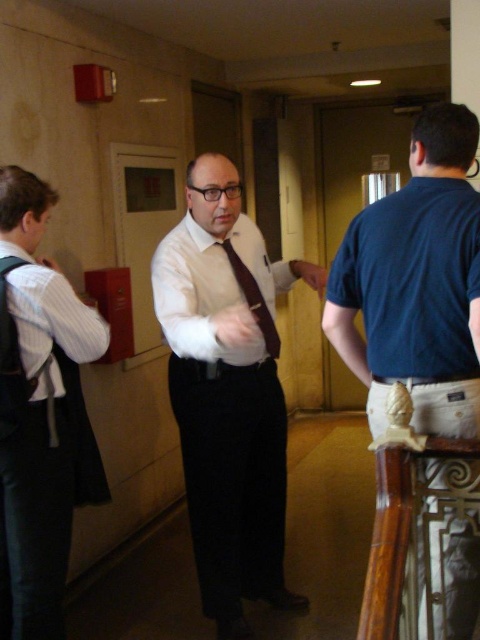
Between striped cotton shirt at left and white striped shirt at left, which one is positioned lower?

striped cotton shirt at left

Is striped cotton shirt at left further to camera compared to white striped shirt at left?

No, it is in front of white striped shirt at left.

The image size is (480, 640). Identify the location of striped cotton shirt at left. tap(39, 413).

This screenshot has width=480, height=640. Describe the element at coordinates (414, 278) in the screenshot. I see `dark blue cotton polo at right` at that location.

Is dark blue cotton polo at right taller than white striped shirt at left?

Correct, dark blue cotton polo at right is much taller as white striped shirt at left.

Does point (442, 220) come behind point (96, 324)?

No, (442, 220) is closer to viewer.

This screenshot has width=480, height=640. I want to click on dark blue cotton polo at right, so click(414, 278).

Does white glossy shirt at center have a lesser width compared to blue cotton shirt at right?

No.

Between point (272, 433) and point (368, 316), which one is positioned behind?

Point (272, 433)

Measure the distance between point [243,236] and camera.

A distance of 2.59 meters exists between point [243,236] and camera.

Find the location of a particular element. white glossy shirt at center is located at coordinates (228, 392).